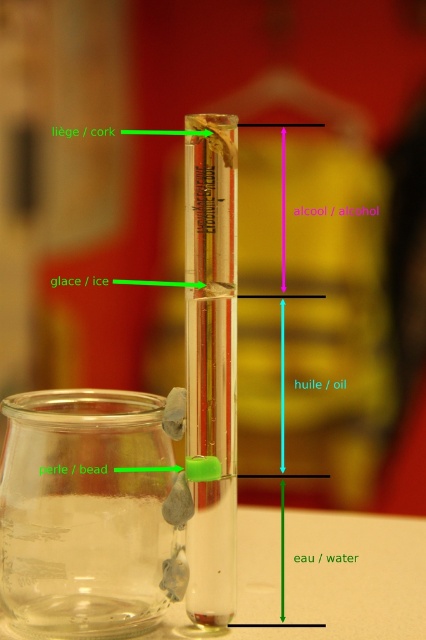
You are a student in a chemistry lab and need to pour the contents of the transparent glass jar at lower left into the transparent glass beaker at center. Based on their positions, can you directly pour from the jar to the beaker without moving either container?

The transparent glass jar at lower left is to the left of the transparent glass beaker at center, so you can directly pour from the jar to the beaker as they are positioned side by side horizontally.

You are a student observing the experiment setup. You need to access the transparent glass beaker at center to record its contents. However, the transparent glass jar at lower left is blocking your view. Can you move the jar to the side to get a clear view of the beaker?

The transparent glass beaker at center is behind the transparent glass jar at lower left, so you can move the jar to the side to get a clear view of the beaker.

Based on the photo, you are a student in a chemistry lab and need to pour the contents of the transparent glass jar at lower left into the transparent glass beaker at center. Will the beaker be able to hold all the liquid without spilling?

The transparent glass jar at lower left has a larger size compared to the transparent glass beaker at center. Since the jar is larger, its capacity is greater than the beaker. Pouring its contents into the smaller beaker may cause overflow and spilling.